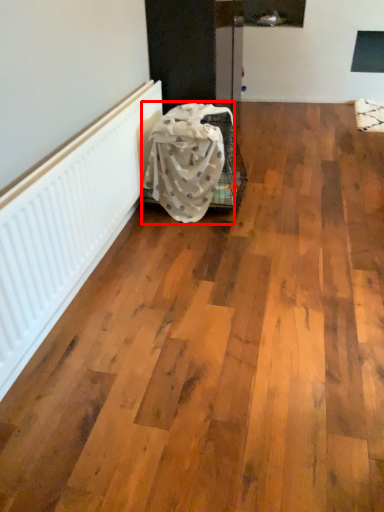
Question: Observing the image, what is the correct spatial positioning of blanket (annotated by the red box) in reference to radiator?

Choices:
 (A) right
 (B) left

Answer: (A)